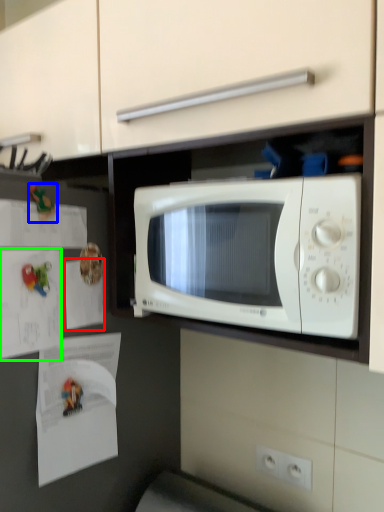
Question: Based on their relative distances, which object is nearer to paper (highlighted by a red box)? Choose from toy (highlighted by a blue box) and paper (highlighted by a green box).

Choices:
 (A) toy
 (B) paper

Answer: (B)